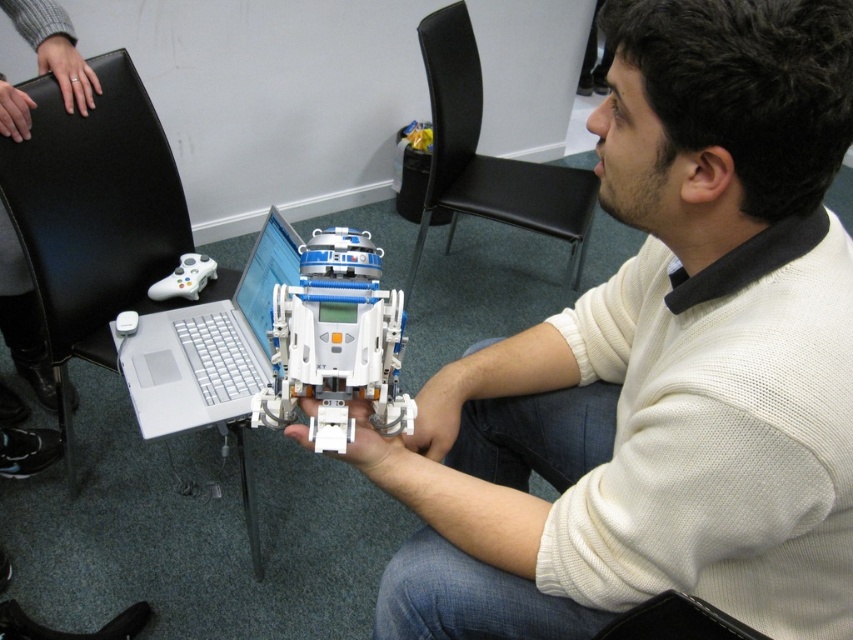
Which is behind, point (740, 506) or point (647, 604)?

The point (647, 604) is more distant.

Does white matte robot at center have a greater width compared to black fabric chair at lower right?

Yes.

Which is in front, point (485, 624) or point (704, 616)?

Point (704, 616) is more forward.

At what (x,y) coordinates should I click in order to perform the action: click on white matte robot at center. Please return your answer as a coordinate pair (x, y). This screenshot has width=853, height=640. Looking at the image, I should click on (660, 364).

Is white matte robot at center bigger than silver metallic laptop at center?

Indeed, white matte robot at center has a larger size compared to silver metallic laptop at center.

Between white matte robot at center and silver metallic laptop at center, which one is positioned lower?

white matte robot at center is lower down.

Locate an element on the screen. This screenshot has height=640, width=853. white matte robot at center is located at coordinates (660, 364).

Is black leather chair at upper center further to the viewer compared to black fabric chair at lower right?

Yes, black leather chair at upper center is behind black fabric chair at lower right.

Is point (558, 221) behind point (689, 628)?

Yes, point (558, 221) is behind point (689, 628).

Who is more forward, (444, 58) or (665, 596)?

Point (665, 596) is in front.

You are a GUI agent. You are given a task and a screenshot of the screen. Output one action in this format:
    pyautogui.click(x=<x>, y=<y>)
    Task: Click on the black leather chair at upper center
    The height and width of the screenshot is (640, 853).
    Given the screenshot: What is the action you would take?
    pyautogui.click(x=488, y=156)